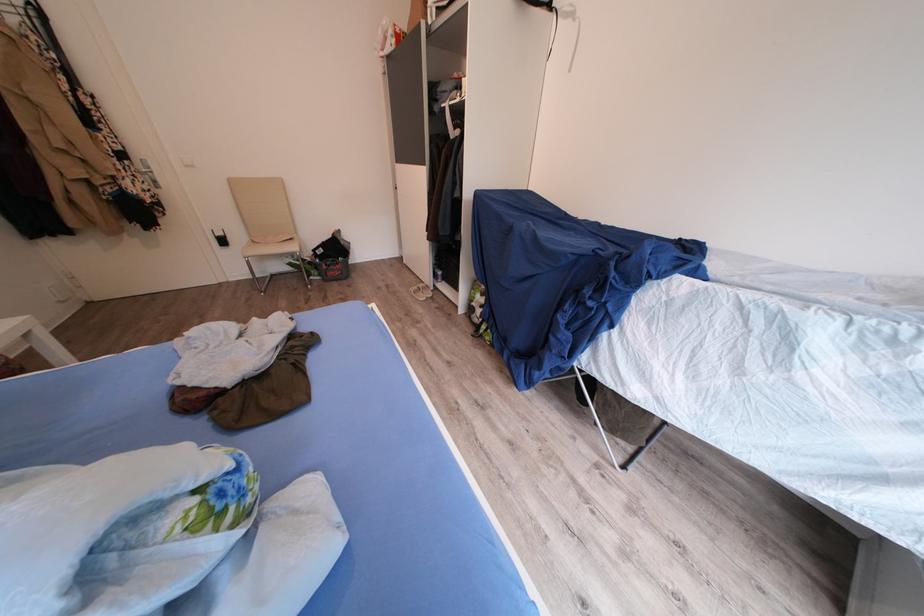
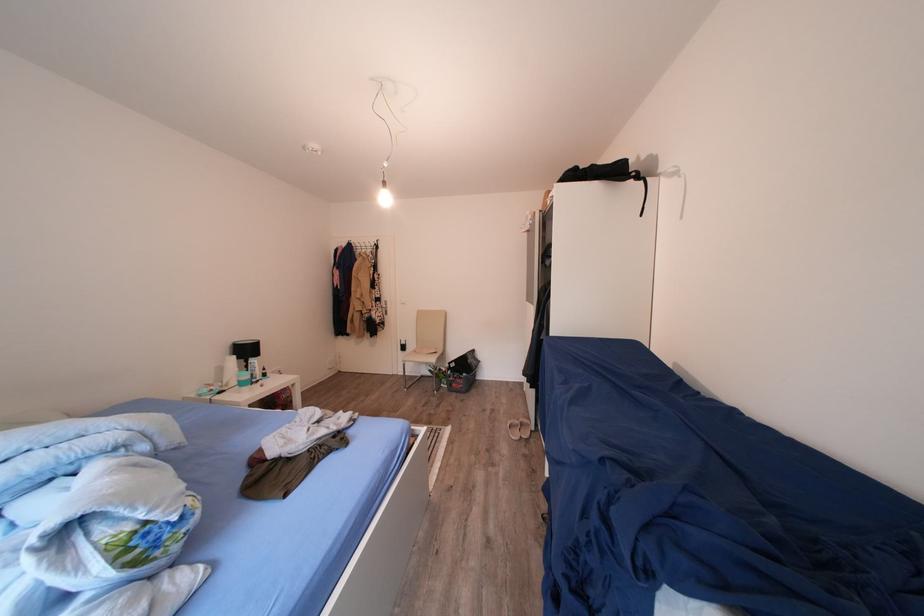
Where in the second image is the point corresponding to the point at 329,281 from the first image?

(456, 390)